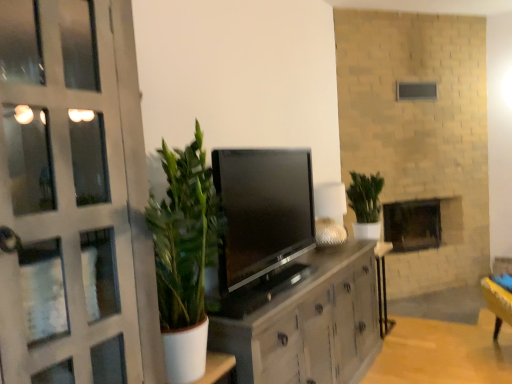
What is the approximate width of satin black tv at center?

The width of satin black tv at center is 11.97 inches.

You are a GUI agent. You are given a task and a screenshot of the screen. Output one action in this format:
    pyautogui.click(x=<x>, y=<y>)
    Task: Click on the brick fireplace at center
    This screenshot has height=384, width=512.
    Given the screenshot: What is the action you would take?
    pyautogui.click(x=421, y=223)

In the scene shown: Measure the distance between point (x=346, y=316) and camera.

Point (x=346, y=316) and camera are 2.68 meters apart.

This screenshot has width=512, height=384. In order to click on wooden table at center in this screenshot , I will do `click(382, 286)`.

Which object is positioned more to the left, wooden table at center or satin black tv at center?

Positioned to the left is satin black tv at center.

Is wooden table at center completely or partially outside of satin black tv at center?

wooden table at center lies outside satin black tv at center's area.

At what (x,y) coordinates should I click in order to perform the action: click on television above the wooden table at center (from a real-world perspective). Please return your answer as a coordinate pair (x, y). The width and height of the screenshot is (512, 384). Looking at the image, I should click on (262, 211).

Is wooden table at center positioned with its back to satin black tv at center?

wooden table at center does not have its back to satin black tv at center.

Considering the sizes of brick fireplace at center and wooden table at center in the image, is brick fireplace at center taller or shorter than wooden table at center?

brick fireplace at center is shorter than wooden table at center.

From the image's perspective, who appears lower, brick fireplace at center or wooden table at center?

wooden table at center is shown below in the image.

From a real-world perspective, is brick fireplace at center positioned above or below wooden table at center?

brick fireplace at center is above wooden table at center.

Is brick fireplace at center to the left or to the right of wooden table at center in the image?

brick fireplace at center is positioned on wooden table at center's right side.

Is matte white cabinet at center behind green leafy plant at center?

That is False.

Could you tell me if matte white cabinet at center is facing green leafy plant at center?

No, matte white cabinet at center is not turned towards green leafy plant at center.

Which of these two, matte white cabinet at center or green leafy plant at center, is wider?

Wider between the two is matte white cabinet at center.

From the image's perspective, is matte white cabinet at center above or below satin black tv at center?

Based on their image positions, matte white cabinet at center is located beneath satin black tv at center.

Which is nearer, (339, 310) or (278, 172)?

Point (339, 310) is positioned farther from the camera compared to point (278, 172).

Would you say matte white cabinet at center contains satin black tv at center?

That's incorrect, satin black tv at center is not inside matte white cabinet at center.

What's the angular difference between matte white cabinet at center and satin black tv at center's facing directions?

The facing directions of matte white cabinet at center and satin black tv at center are 0.351 degrees apart.

Is green leafy plant at center looking in the opposite direction of satin black tv at center?

No, green leafy plant at center's orientation is not away from satin black tv at center.

Consider the image. Measure the distance from green leafy plant at center to satin black tv at center.

green leafy plant at center and satin black tv at center are 1.25 meters apart.

Do you think green leafy plant at center is within satin black tv at center, or outside of it?

green leafy plant at center is spatially situated outside satin black tv at center.

Which object is more forward, green leafy plant at center or satin black tv at center?

Positioned in front is satin black tv at center.

From a real-world perspective, between satin black tv at center and matte white cabinet at center, who is vertically lower?

In real-world perspective, matte white cabinet at center is lower.

Is matte white cabinet at center at the back of satin black tv at center?

No, satin black tv at center is not facing the opposite direction of matte white cabinet at center.

Is satin black tv at center inside the boundaries of matte white cabinet at center, or outside?

satin black tv at center lies outside matte white cabinet at center.

Considering the positions of objects satin black tv at center and matte white cabinet at center in the image provided, who is behind, satin black tv at center or matte white cabinet at center?

Positioned behind is satin black tv at center.

Considering the relative sizes of satin black tv at center and matte white door at left in the image provided, is satin black tv at center taller than matte white door at left?

No.

From the image's perspective, is satin black tv at center above matte white door at left?

No, from the image's perspective, satin black tv at center is not over matte white door at left.

From a real-world perspective, is satin black tv at center over matte white door at left?

No, from a real-world perspective, satin black tv at center is not over matte white door at left

The height and width of the screenshot is (384, 512). In the image, there is a satin black tv at center. In order to click on table below it (from a real-world perspective) in this screenshot , I will do `click(382, 286)`.

I want to click on fireplace behind the wooden table at center, so click(421, 223).

From the image, which object appears to be nearer to matte white door at left, satin black tv at center or green leafy plant at center?

satin black tv at center lies closer to matte white door at left than the other object.

From the image, which object appears to be farther from wooden table at center, green leafy plant at center or brick fireplace at center?

brick fireplace at center lies further to wooden table at center than the other object.

From the image, which object appears to be nearer to satin black tv at center, matte white door at left or brick fireplace at center?

matte white door at left is closer to satin black tv at center.

Considering their positions, is matte white door at left positioned further to matte white cabinet at center than brick fireplace at center?

brick fireplace at center.

From the image, which object appears to be nearer to wooden table at center, matte white door at left or brick fireplace at center?

Among the two, brick fireplace at center is located nearer to wooden table at center.

Which object lies nearer to the anchor point matte white door at left, matte white cabinet at center or brick fireplace at center?

Among the two, matte white cabinet at center is located nearer to matte white door at left.

Which object lies nearer to the anchor point brick fireplace at center, green leafy plant at center or matte white cabinet at center?

Based on the image, green leafy plant at center appears to be nearer to brick fireplace at center.

When comparing their distances from green leafy plant at center, does satin black tv at center or matte white cabinet at center seem further?

Based on the image, satin black tv at center appears to be further to green leafy plant at center.

Find the location of `table between matte white cabinet at center and brick fireplace at center along the z-axis`. table between matte white cabinet at center and brick fireplace at center along the z-axis is located at coordinates (382, 286).

Image resolution: width=512 pixels, height=384 pixels. I want to click on television between matte white cabinet at center and green leafy plant at center along the z-axis, so click(262, 211).

In order to click on table between satin black tv at center and brick fireplace at center in the front-back direction in this screenshot , I will do click(x=382, y=286).

The image size is (512, 384). Find the location of `cabinetry between matte white door at left and wooden table at center along the z-axis`. cabinetry between matte white door at left and wooden table at center along the z-axis is located at coordinates (305, 320).